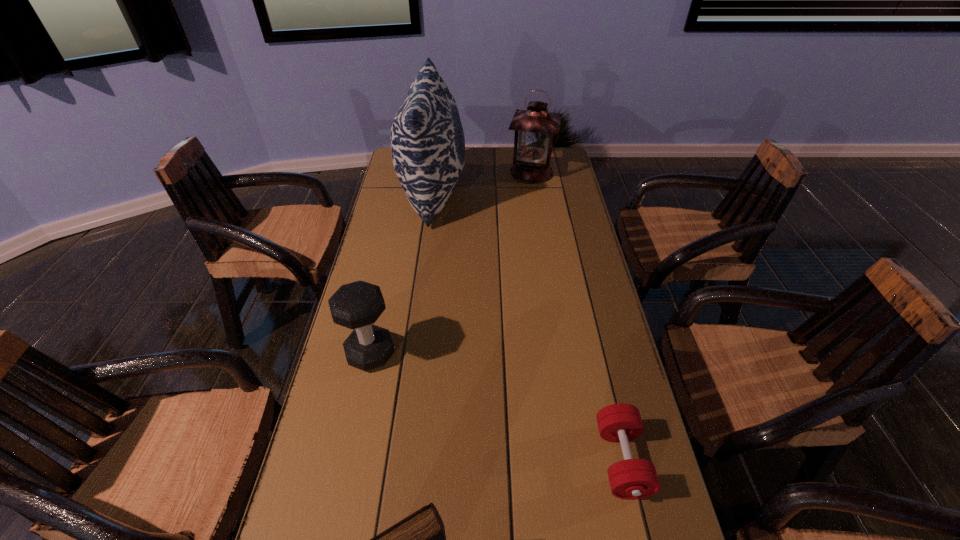
In the image, there is a desktop. At what (x,y) coordinates should I click in order to perform the action: click on free space at the right edge. Please return your answer as a coordinate pair (x, y). Looking at the image, I should click on (563, 209).

The width and height of the screenshot is (960, 540). What are the coordinates of `unoccupied area between the shorter dumbbell and the farther dumbbell` in the screenshot? It's located at (496, 407).

Where is `vacant area that lies between the second tallest object and the right dumbbell`? This screenshot has width=960, height=540. vacant area that lies between the second tallest object and the right dumbbell is located at coordinates (577, 316).

Locate an element on the screen. This screenshot has height=540, width=960. free area in between the farther dumbbell and the shortest object is located at coordinates (496, 407).

Locate an element on the screen. This screenshot has width=960, height=540. unoccupied area between the tallest object and the fourth farthest object is located at coordinates (527, 327).

The image size is (960, 540). I want to click on unoccupied area between the oil lamp and the cushion, so click(x=483, y=183).

This screenshot has height=540, width=960. Identify the location of vacant space that's between the third nearest object and the shorter dumbbell. (496, 407).

Locate an element on the screen. The height and width of the screenshot is (540, 960). free space between the oil lamp and the cushion is located at coordinates click(x=483, y=183).

Identify the location of the third closest object to the second nearest object. Image resolution: width=960 pixels, height=540 pixels. (427, 140).

Find the location of a particular element. The image size is (960, 540). the closest object to the farther dumbbell is located at coordinates (419, 539).